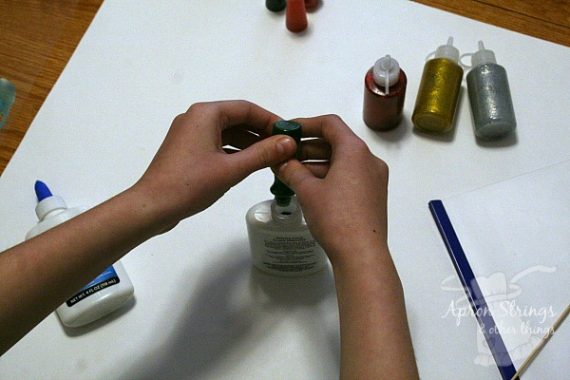
I want to click on glitter paint bottle, so click(x=381, y=103), click(x=437, y=88), click(x=491, y=98).